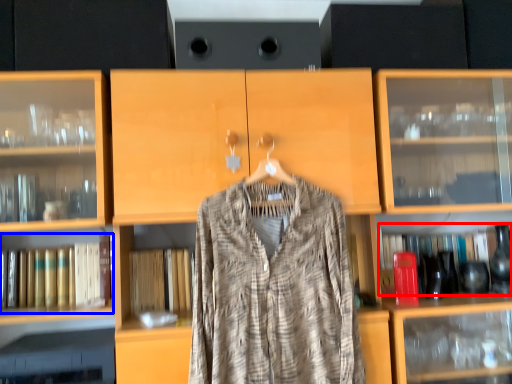
Question: Which object appears farthest to the camera in this image, book (highlighted by a red box) or book (highlighted by a blue box)?

Choices:
 (A) book
 (B) book

Answer: (A)